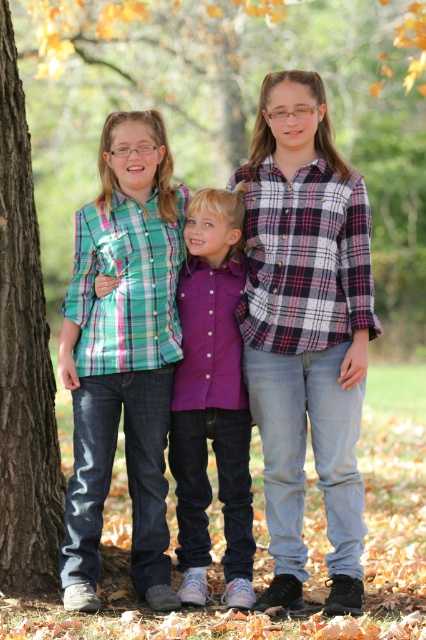
Question: Which point is farther to the camera?

Choices:
 (A) (232, 525)
 (B) (356, 440)
 (C) (152, 428)

Answer: (A)

Question: Is the position of matte plaid shirt at left less distant than that of purple cotton shirt at center?

Choices:
 (A) yes
 (B) no

Answer: (A)

Question: Based on their relative distances, which object is nearer to the plaid flannel shirt at center?

Choices:
 (A) purple cotton shirt at center
 (B) matte plaid shirt at left
 (C) brown rough bark at left
 (D) plaid shirt at center

Answer: (D)

Question: Can you confirm if plaid shirt at center is thinner than brown rough bark at left?

Choices:
 (A) no
 (B) yes

Answer: (A)

Question: From the image, what is the correct spatial relationship of purple cotton shirt at center in relation to brown rough bark at left?

Choices:
 (A) right
 (B) left

Answer: (A)

Question: Which is farther from the plaid shirt at center?

Choices:
 (A) purple cotton shirt at center
 (B) plaid flannel shirt at center
 (C) matte plaid shirt at left

Answer: (C)